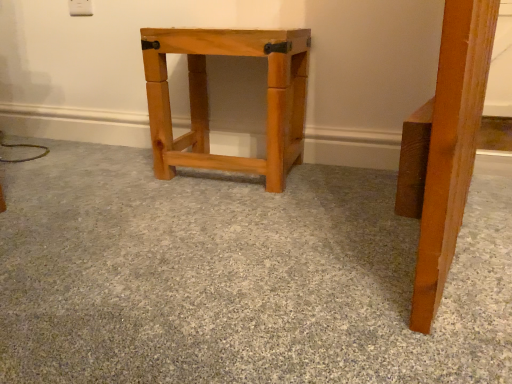
Question: Is natural wood stool at center bigger or smaller than natural wood table at center?

Choices:
 (A) small
 (B) big

Answer: (A)

Question: From a real-world perspective, is natural wood stool at center positioned above or below natural wood table at center?

Choices:
 (A) above
 (B) below

Answer: (A)

Question: In the image, is natural wood stool at center positioned in front of or behind natural wood table at center?

Choices:
 (A) behind
 (B) front

Answer: (A)

Question: From the image's perspective, is natural wood table at center located above or below natural wood stool at center?

Choices:
 (A) above
 (B) below

Answer: (B)

Question: Considering the positions of point (x=404, y=266) and point (x=290, y=163), is point (x=404, y=266) closer or farther from the camera than point (x=290, y=163)?

Choices:
 (A) farther
 (B) closer

Answer: (B)

Question: Would you say natural wood table at center is inside or outside natural wood stool at center?

Choices:
 (A) inside
 (B) outside

Answer: (B)

Question: In the image, is natural wood table at center positioned in front of or behind natural wood stool at center?

Choices:
 (A) behind
 (B) front

Answer: (B)